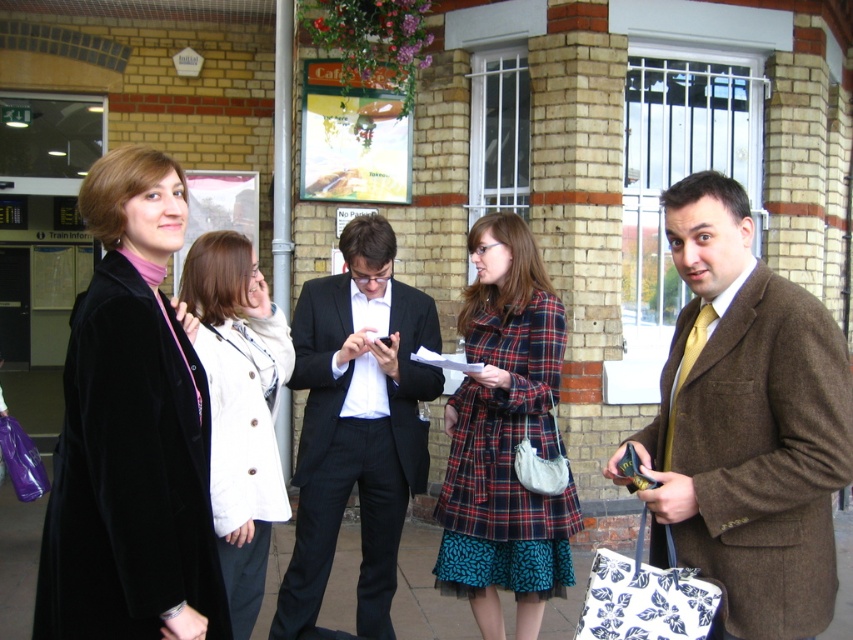
You are a tailor who needs to determine which material is easier to fold between the plaid fabric coat at center and the smooth concrete pavement at center. Based on their thickness, which one would you choose?

The plaid fabric coat at center is thinner than the smooth concrete pavement at center, so it is easier to fold.

You are a photographer trying to capture a wide shot of the scene. Since you want to include both the plaid fabric coat at center and the smooth concrete pavement at center in the frame, which object should you focus on to ensure both are in focus?

The plaid fabric coat at center is bigger than the smooth concrete pavement at center, so focusing on the plaid fabric coat at center will ensure both are in focus as it is the larger object in the scene.

You are standing at the train station shown in the image. There is a point at coordinates point (241, 403). Can you reach this point without moving closer than 10 feet to it?

The point (241, 403) is 10.14 feet away from the viewer, so yes, you can reach it without moving closer than 10 feet since the distance is slightly more than 10 feet.